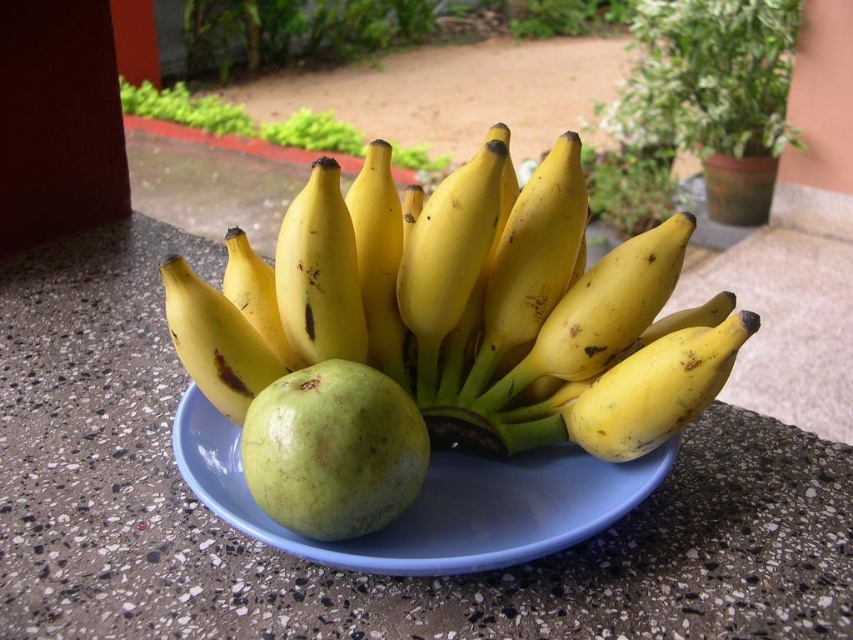
Question: Among these objects, which one is farthest from the camera?

Choices:
 (A) blue plastic plate at center
 (B) yellow matte bananas at center
 (C) smooth concrete countertop at center

Answer: (B)

Question: Which is farther from the blue plastic plate at center?

Choices:
 (A) smooth concrete countertop at center
 (B) green matte apple at center

Answer: (A)

Question: Observing the image, what is the correct spatial positioning of yellow matte bananas at center in reference to blue plastic plate at center?

Choices:
 (A) left
 (B) right

Answer: (B)

Question: Which point is closer to the camera taking this photo?

Choices:
 (A) (375, 515)
 (B) (309, 355)

Answer: (A)

Question: Considering the relative positions of smooth concrete countertop at center and blue plastic plate at center in the image provided, where is smooth concrete countertop at center located with respect to blue plastic plate at center?

Choices:
 (A) left
 (B) right

Answer: (A)

Question: Can you confirm if smooth concrete countertop at center is positioned below green matte apple at center?

Choices:
 (A) yes
 (B) no

Answer: (A)